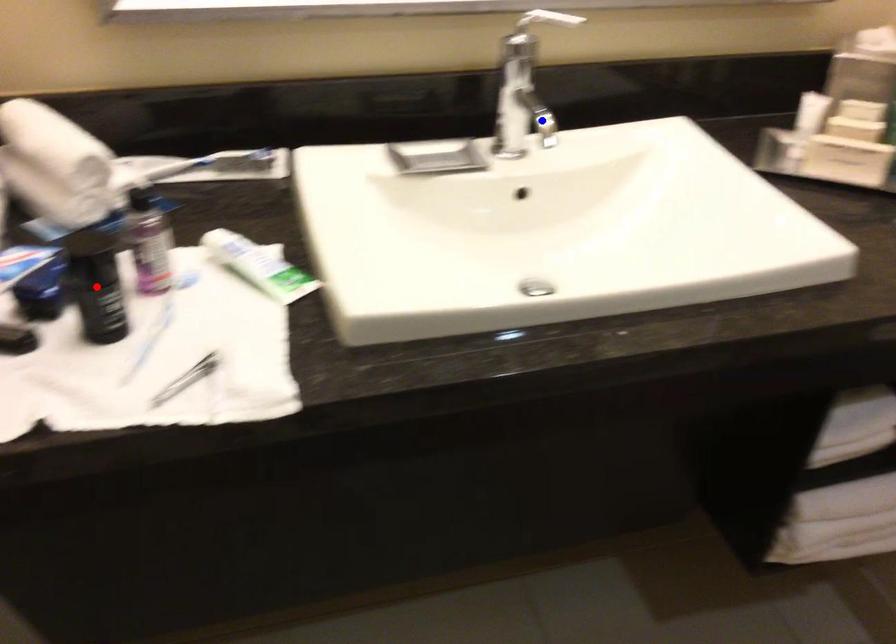
Question: In the image, two points are highlighted. Which point is nearer to the camera? Reply with the corresponding letter.

Choices:
 (A) blue point
 (B) red point

Answer: (B)